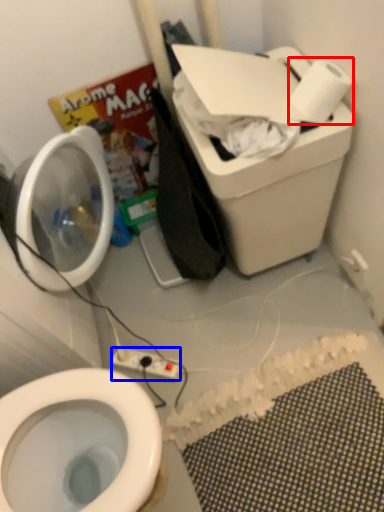
Question: Which point is closer to the camera, toilet paper (highlighted by a red box) or electric outlet (highlighted by a blue box)?

Choices:
 (A) toilet paper
 (B) electric outlet

Answer: (A)